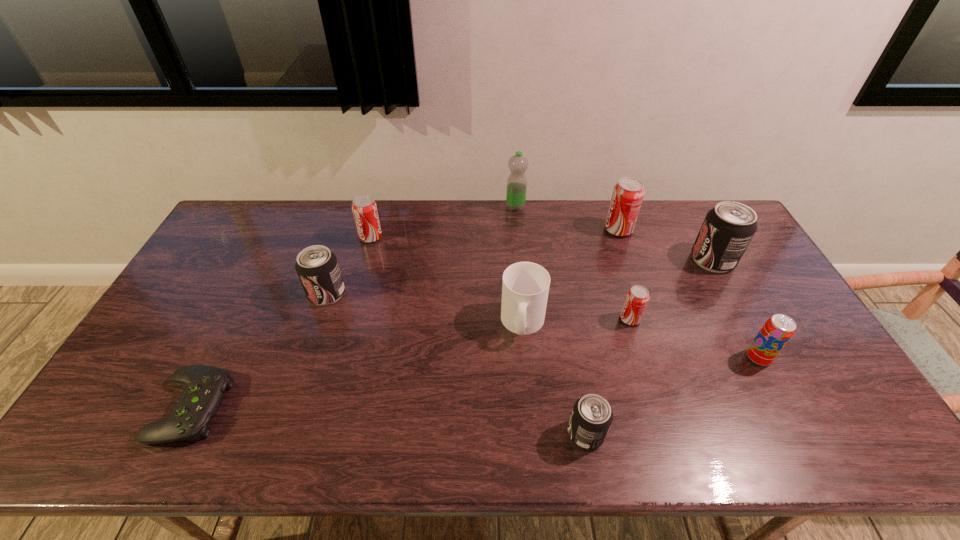
Locate an element on the screen. This screenshot has height=540, width=960. vacant space located 0.060m on the front of the biggest black soda can is located at coordinates (729, 288).

In order to click on free space located on the handle side of the white mug in this screenshot , I will do `click(532, 426)`.

Locate an element on the screen. The image size is (960, 540). free space located on the front of the fourth farthest soda can is located at coordinates (294, 390).

Image resolution: width=960 pixels, height=540 pixels. In order to click on vacant space located on the logo side of the second smallest red soda can in this screenshot , I will do `click(411, 237)`.

Locate an element on the screen. The image size is (960, 540). vacant area situated 0.110m on the left of the third nearest object is located at coordinates [x=706, y=357].

Find the location of a particular element. vacant space situated on the logo side of the fifth farthest soda can is located at coordinates (558, 319).

Find the location of a particular element. blank space located on the logo side of the fifth farthest soda can is located at coordinates (588, 319).

Where is `vacant space located on the logo side of the fifth farthest soda can`? The width and height of the screenshot is (960, 540). vacant space located on the logo side of the fifth farthest soda can is located at coordinates (562, 319).

Locate an element on the screen. This screenshot has height=540, width=960. free point located 0.200m on the right of the second black soda can from right to left is located at coordinates (688, 434).

Find the location of a particular element. The width and height of the screenshot is (960, 540). free point located 0.100m on the right of the control is located at coordinates coord(266,408).